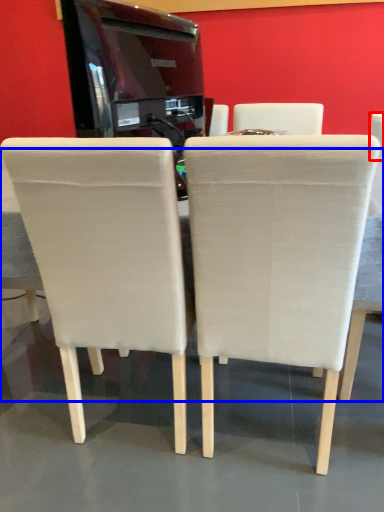
Question: Which object is closer to the camera taking this photo, chair (highlighted by a red box) or table (highlighted by a blue box)?

Choices:
 (A) chair
 (B) table

Answer: (B)